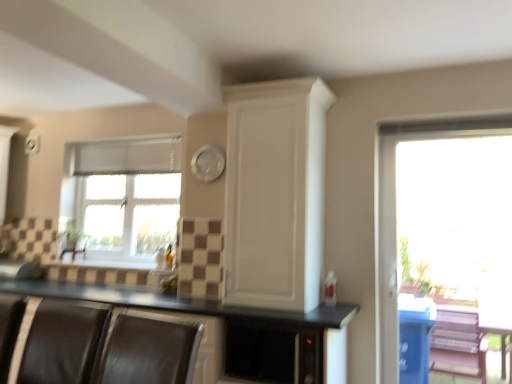
Identify the location of transparent glass window at right, which ranks as the 1th window in front-to-back order. (444, 243).

What do you see at coordinates (215, 315) in the screenshot?
I see `black matte countertop at center` at bounding box center [215, 315].

Measure the distance between point (70, 242) and camera.

Point (70, 242) and camera are 12.14 feet apart.

How much space does black leather armchair at lower left, which is counted as the first armchair, starting from the right, occupy vertically?

The height of black leather armchair at lower left, which is counted as the first armchair, starting from the right, is 15.68 inches.

You are a GUI agent. You are given a task and a screenshot of the screen. Output one action in this format:
    pyautogui.click(x=<x>, y=<y>)
    Task: Click on the white matte cabinet at upper center
    
    Given the screenshot: What is the action you would take?
    pyautogui.click(x=275, y=193)

What do you see at coordinates (128, 156) in the screenshot? The image size is (512, 384). I see `white fabric blind at upper left` at bounding box center [128, 156].

The image size is (512, 384). Identify the location of transparent glass window at right, the 1th window from the right. (444, 243).

Which of these two, black matte countertop at center or brown leather armchair at lower left, which is the second armchair in right-to-left order, stands shorter?

With less height is brown leather armchair at lower left, which is the second armchair in right-to-left order.

Is brown leather armchair at lower left, which ranks as the 2th armchair in front-to-back order, a part of black matte countertop at center?

No, brown leather armchair at lower left, which ranks as the 2th armchair in front-to-back order, is not surrounded by black matte countertop at center.

The width and height of the screenshot is (512, 384). I want to click on countertop below the brown leather armchair at lower left, which ranks as the 2th armchair in front-to-back order (from the image's perspective), so click(x=215, y=315).

From a real-world perspective, between black leather armchair at lower left, which is counted as the first armchair, starting from the right, and white textured window at left, the 2th window viewed from the front, who is vertically lower?

In real-world perspective, black leather armchair at lower left, which is counted as the first armchair, starting from the right, is lower.

Is black leather armchair at lower left, positioned as the 2th armchair in left-to-right order, facing towards white textured window at left, which ranks as the first window in left-to-right order?

No, black leather armchair at lower left, positioned as the 2th armchair in left-to-right order, is not aimed at white textured window at left, which ranks as the first window in left-to-right order.

Which of these two, black leather armchair at lower left, marked as the 2th armchair in a back-to-front arrangement, or white textured window at left, which ranks as the first window in left-to-right order, is smaller?

black leather armchair at lower left, marked as the 2th armchair in a back-to-front arrangement, is smaller.

How many degrees apart are the facing directions of black leather armchair at lower left, marked as the first armchair in a front-to-back arrangement, and white textured window at left, arranged as the 2th window when viewed from the right?

The facing directions of black leather armchair at lower left, marked as the first armchair in a front-to-back arrangement, and white textured window at left, arranged as the 2th window when viewed from the right, are 3.64 degrees apart.

Considering the positions of point (73, 245) and point (85, 307), is point (73, 245) closer or farther from the camera than point (85, 307)?

Point (73, 245) is positioned farther from the camera compared to point (85, 307).

From a real-world perspective, is brown leather armchair at lower left, the first armchair from the left, positioned above or below black leather armchair at lower left, positioned as the 2th armchair in left-to-right order?

Clearly, from a real-world perspective, brown leather armchair at lower left, the first armchair from the left, is above black leather armchair at lower left, positioned as the 2th armchair in left-to-right order.

Does brown leather armchair at lower left, the first armchair from the back, have a lesser width compared to black leather armchair at lower left, positioned as the 2th armchair in left-to-right order?

Yes, brown leather armchair at lower left, the first armchair from the back, is thinner than black leather armchair at lower left, positioned as the 2th armchair in left-to-right order.

The height and width of the screenshot is (384, 512). In the image, there is a black leather armchair at lower left, marked as the 2th armchair in a back-to-front arrangement. Identify the location of armchair above it (from the image's perspective). (74, 248).

Would you consider white fabric blind at upper left to be distant from black matte countertop at center?

Indeed, white fabric blind at upper left is not near black matte countertop at center.

Would you say black matte countertop at center is part of white fabric blind at upper left's contents?

No, white fabric blind at upper left does not contain black matte countertop at center.

I want to click on countertop that appears below the white fabric blind at upper left (from a real-world perspective), so click(215, 315).

Looking at the image, does white textured window at left, the 2th window viewed from the front, seem bigger or smaller compared to brown leather armchair at lower left, which is the second armchair in right-to-left order?

white textured window at left, the 2th window viewed from the front, is bigger than brown leather armchair at lower left, which is the second armchair in right-to-left order.

Is white textured window at left, which ranks as the first window in left-to-right order, positioned before brown leather armchair at lower left, the first armchair from the left?

Yes, the depth of white textured window at left, which ranks as the first window in left-to-right order, is less than that of brown leather armchair at lower left, the first armchair from the left.

Is white textured window at left, which ranks as the first window in left-to-right order, touching brown leather armchair at lower left, the first armchair from the back?

white textured window at left, which ranks as the first window in left-to-right order, and brown leather armchair at lower left, the first armchair from the back, are not in contact.

Considering the relative positions of white textured window at left, the 2th window viewed from the front, and brown leather armchair at lower left, which is the second armchair in right-to-left order, in the image provided, is white textured window at left, the 2th window viewed from the front, to the left of brown leather armchair at lower left, which is the second armchair in right-to-left order, from the viewer's perspective?

Incorrect, white textured window at left, the 2th window viewed from the front, is not on the left side of brown leather armchair at lower left, which is the second armchair in right-to-left order.

Looking at their sizes, would you say white matte cabinet at upper center is wider or thinner than brown leather armchair at lower left, which ranks as the 2th armchair in front-to-back order?

Clearly, white matte cabinet at upper center has more width compared to brown leather armchair at lower left, which ranks as the 2th armchair in front-to-back order.

Is white matte cabinet at upper center facing towards brown leather armchair at lower left, the first armchair from the left?

No, white matte cabinet at upper center is not aimed at brown leather armchair at lower left, the first armchair from the left.

Which is nearer, (x=265, y=220) or (x=68, y=249)?

Clearly, point (x=265, y=220) is closer to the camera than point (x=68, y=249).

Between white matte cabinet at upper center and brown leather armchair at lower left, the first armchair from the back, which one has larger size?

With larger size is white matte cabinet at upper center.

Is transparent glass window at right, which appears as the 2th window when viewed from the back, to the right of black matte countertop at center from the viewer's perspective?

Yes.

Between transparent glass window at right, which ranks as the 1th window in front-to-back order, and black matte countertop at center, which one is positioned in front?

black matte countertop at center is in front.

This screenshot has height=384, width=512. I want to click on the 1st window behind the black matte countertop at center, counting from the anchor's position, so click(x=444, y=243).

From the image's perspective, does transparent glass window at right, the 1th window from the right, appear lower than black matte countertop at center?

No, from the image's perspective, transparent glass window at right, the 1th window from the right, is not beneath black matte countertop at center.

I want to click on the 2nd armchair located above the black matte countertop at center (from a real-world perspective), so pos(74,248).

From the image's perspective, which window is the 2nd one above the black leather armchair at lower left, marked as the first armchair in a front-to-back arrangement? Please provide its 2D coordinates.

[(122, 197)]

Estimate the real-world distances between objects in this image. Which object is further from white textured window at left, arranged as the 2th window when viewed from the right, brown leather armchair at lower left, which ranks as the 2th armchair in front-to-back order, or white fabric blind at upper left?

brown leather armchair at lower left, which ranks as the 2th armchair in front-to-back order, is positioned further to the anchor white textured window at left, arranged as the 2th window when viewed from the right.

Considering their positions, is brown leather armchair at lower left, which ranks as the 2th armchair in front-to-back order, positioned closer to black matte countertop at center than white matte cabinet at upper center?

white matte cabinet at upper center lies closer to black matte countertop at center than the other object.

Which object lies further to the anchor point white fabric blind at upper left, white textured window at left, acting as the 1th window starting from the back, or black leather armchair at lower left, which is counted as the first armchair, starting from the right?

Among the two, black leather armchair at lower left, which is counted as the first armchair, starting from the right, is located further to white fabric blind at upper left.

Looking at this image, which object lies nearer to the anchor point brown leather armchair at lower left, the first armchair from the left, white fabric blind at upper left or transparent glass window at right, which appears as the 2th window when viewed from the back?

white fabric blind at upper left.

Looking at the image, which one is located further to white matte cabinet at upper center, white textured window at left, the 2th window viewed from the front, or white fabric blind at upper left?

Based on the image, white textured window at left, the 2th window viewed from the front, appears to be further to white matte cabinet at upper center.

Considering their positions, is transparent glass window at right, the 1th window from the right, positioned further to brown leather armchair at lower left, which ranks as the 2th armchair in front-to-back order, than black leather armchair at lower left, marked as the first armchair in a front-to-back arrangement?

transparent glass window at right, the 1th window from the right, lies further to brown leather armchair at lower left, which ranks as the 2th armchair in front-to-back order, than the other object.

Estimate the real-world distances between objects in this image. Which object is closer to white fabric blind at upper left, black matte countertop at center or white matte cabinet at upper center?

Based on the image, black matte countertop at center appears to be nearer to white fabric blind at upper left.

In the scene shown: From the image, which object appears to be farther from white matte cabinet at upper center, white fabric blind at upper left or black leather armchair at lower left, which is counted as the first armchair, starting from the right?

The object further to white matte cabinet at upper center is white fabric blind at upper left.

Where is `countertop located between black leather armchair at lower left, positioned as the 2th armchair in left-to-right order, and white fabric blind at upper left in the depth direction`? The height and width of the screenshot is (384, 512). countertop located between black leather armchair at lower left, positioned as the 2th armchair in left-to-right order, and white fabric blind at upper left in the depth direction is located at coordinates (215, 315).

At what (x,y) coordinates should I click in order to perform the action: click on blind between black leather armchair at lower left, marked as the 2th armchair in a back-to-front arrangement, and white textured window at left, the 2th window viewed from the front, along the z-axis. Please return your answer as a coordinate pair (x, y). Looking at the image, I should click on (128, 156).

This screenshot has height=384, width=512. What are the coordinates of `countertop between white textured window at left, which ranks as the first window in left-to-right order, and transparent glass window at right, which ranks as the 1th window in front-to-back order, from left to right` in the screenshot? It's located at (215, 315).

What are the coordinates of `countertop between black leather armchair at lower left, marked as the first armchair in a front-to-back arrangement, and brown leather armchair at lower left, the first armchair from the left, along the z-axis` in the screenshot? It's located at (215, 315).